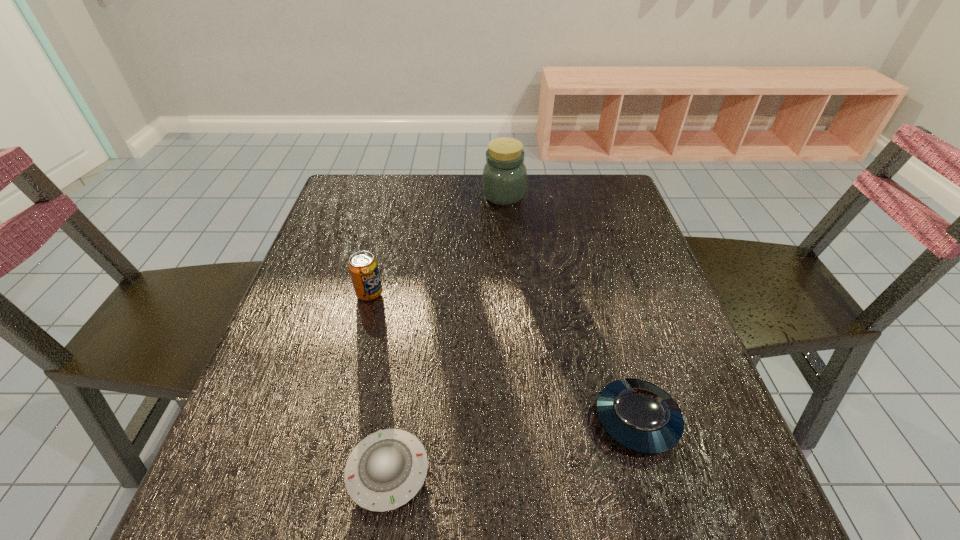
Where is `vacant area that lies between the second farthest object and the left saucer`? The width and height of the screenshot is (960, 540). vacant area that lies between the second farthest object and the left saucer is located at coordinates (378, 382).

Where is `object identified as the second closest to the third tallest object`? The height and width of the screenshot is (540, 960). object identified as the second closest to the third tallest object is located at coordinates (363, 267).

The height and width of the screenshot is (540, 960). I want to click on object that is the second closest one to the second shortest object, so click(363, 267).

Locate an element on the screen. This screenshot has height=540, width=960. blank space that satisfies the following two spatial constraints: 1. on the front side of the third shortest object; 2. on the left side of the shortest object is located at coordinates (324, 472).

Find the location of `free region that satisfies the following two spatial constraints: 1. on the front side of the soda can; 2. on the left side of the rightmost object`. free region that satisfies the following two spatial constraints: 1. on the front side of the soda can; 2. on the left side of the rightmost object is located at coordinates (337, 420).

Where is `free space that satisfies the following two spatial constraints: 1. on the front side of the second object from left to right; 2. on the right side of the leftmost object`? free space that satisfies the following two spatial constraints: 1. on the front side of the second object from left to right; 2. on the right side of the leftmost object is located at coordinates (324, 472).